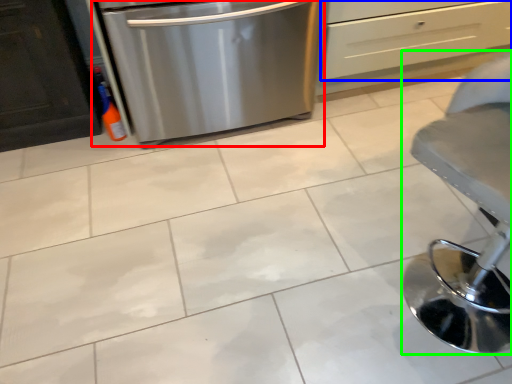
Question: Which is farther away from home appliance (highlighted by a red box)? drawer (highlighted by a blue box) or furniture (highlighted by a green box)?

Choices:
 (A) drawer
 (B) furniture

Answer: (B)